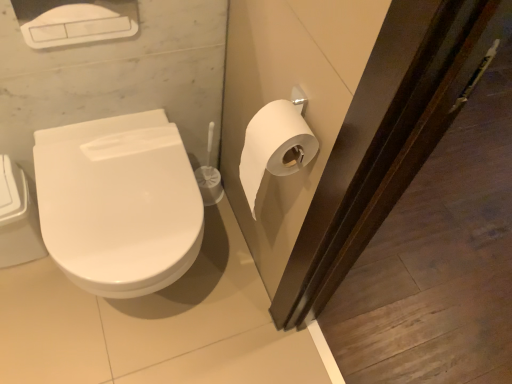
Question: Is white matte toilet paper at right positioned with its back to white glossy toilet at left?

Choices:
 (A) yes
 (B) no

Answer: (B)

Question: Can you confirm if white matte toilet paper at right is positioned to the left of white glossy toilet at left?

Choices:
 (A) no
 (B) yes

Answer: (A)

Question: From the image's perspective, is white matte toilet paper at right under white glossy toilet at left?

Choices:
 (A) yes
 (B) no

Answer: (B)

Question: Does white matte toilet paper at right have a larger size compared to white glossy toilet at left?

Choices:
 (A) yes
 (B) no

Answer: (B)

Question: Does white matte toilet paper at right have a lesser height compared to white glossy toilet at left?

Choices:
 (A) no
 (B) yes

Answer: (B)

Question: Is white matte toilet paper at right positioned beyond the bounds of white glossy toilet at left?

Choices:
 (A) yes
 (B) no

Answer: (A)

Question: Does white glossy toilet at left lie behind white matte toilet paper at right?

Choices:
 (A) yes
 (B) no

Answer: (A)

Question: Is white glossy toilet at left shorter than white matte toilet paper at right?

Choices:
 (A) no
 (B) yes

Answer: (A)

Question: Is white matte toilet paper at right a part of white glossy toilet at left?

Choices:
 (A) no
 (B) yes

Answer: (A)

Question: Does white glossy toilet at left appear on the right side of white matte toilet paper at right?

Choices:
 (A) no
 (B) yes

Answer: (A)

Question: Is white glossy toilet at left outside white matte toilet paper at right?

Choices:
 (A) yes
 (B) no

Answer: (A)

Question: Is white glossy toilet at left not near white matte toilet paper at right?

Choices:
 (A) no
 (B) yes

Answer: (A)

Question: Is white glossy toilet at left inside or outside of white matte toilet paper at right?

Choices:
 (A) inside
 (B) outside

Answer: (B)